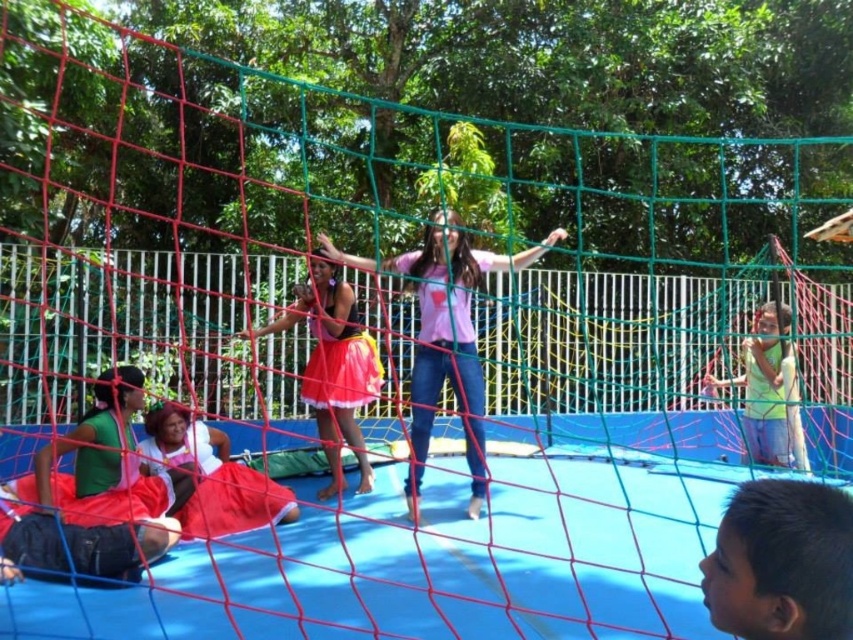
You are a photographer trying to capture a photo of the two children mentioned in the scene. The pink satin skirt at center and the matte red dress at lower left are both in your viewfinder. To ensure both are in the frame, should you adjust your camera to the left or right? Explain your reasoning based on their positions.

The pink satin skirt at center is to the right of the matte red dress at lower left. Therefore, to include both in the frame without moving the camera, you should adjust your camera to the left to ensure the matte red dress at lower left is fully visible while keeping the pink satin skirt at center in view.

You are a photographer trying to capture a photo of the pink matte skirt at center and the matte red dress at lower left. Based on their positions, which one would appear larger in the photo?

The pink matte skirt at center appears larger in the photo because it is taller than the matte red dress at lower left.